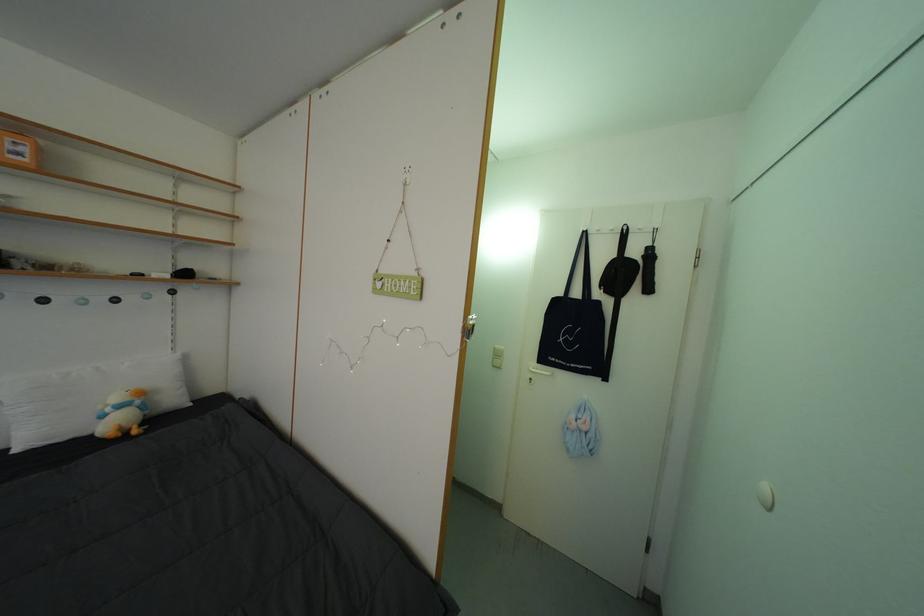
Identify the location of white pillow. This screenshot has width=924, height=616. (83, 397).